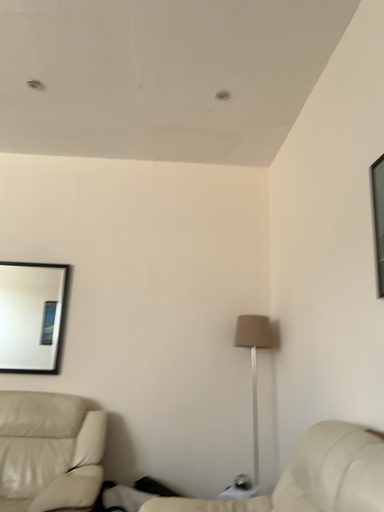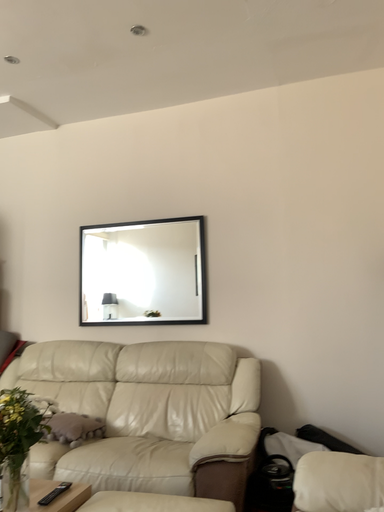
Question: Which way did the camera rotate in the video?

Choices:
 (A) rotated downward
 (B) rotated upward

Answer: (A)